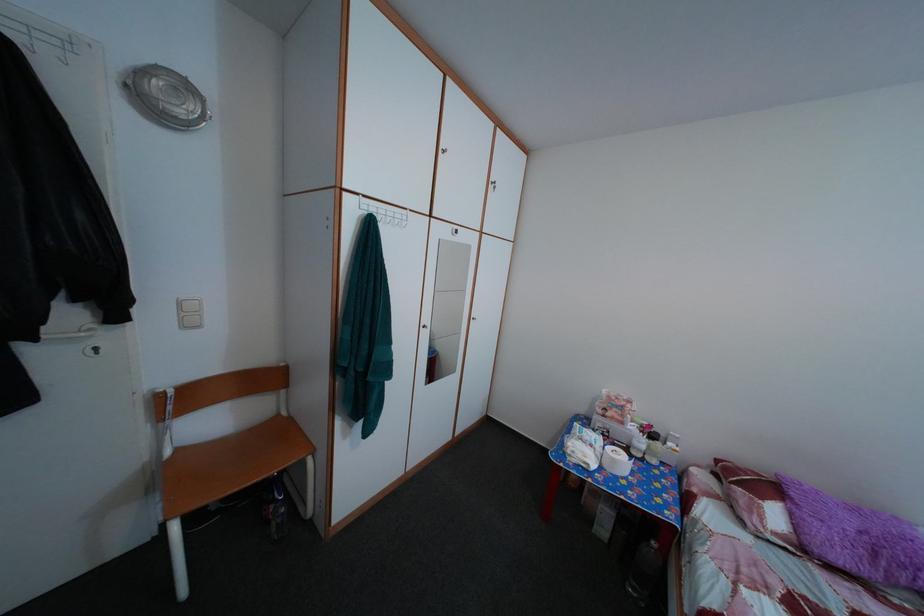
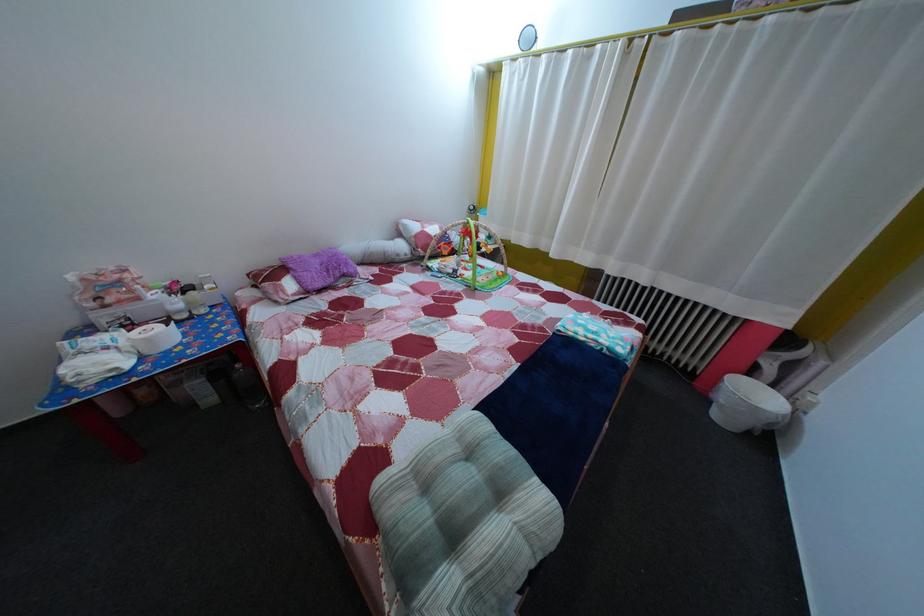
In the second image, find the point that corresponds to point 864,517 in the first image.

(325, 262)